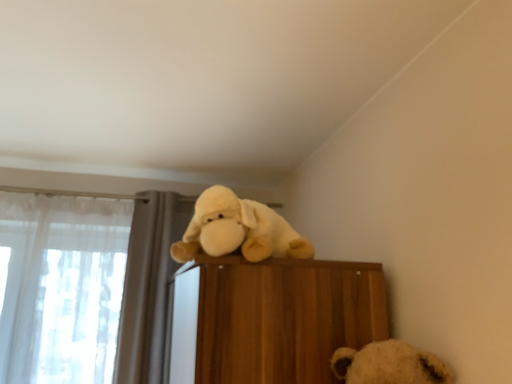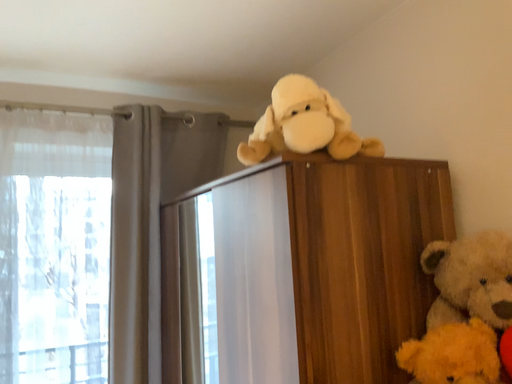
Question: Which way did the camera rotate in the video?

Choices:
 (A) rotated right
 (B) rotated left

Answer: (A)